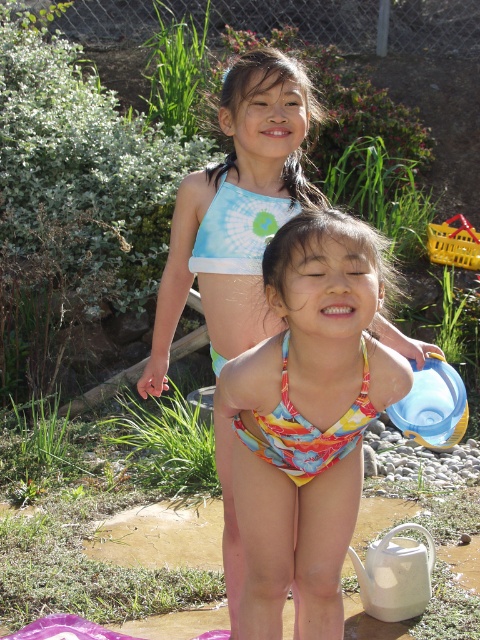
Question: Which point appears closest to the camera in this image?

Choices:
 (A) (232, 529)
 (B) (345, 413)

Answer: (B)

Question: Observing the image, what is the correct spatial positioning of multicolored fabric swimsuit at center in reference to multicolored printed swimsuit at center?

Choices:
 (A) above
 (B) below

Answer: (B)

Question: Considering the real-world distances, which object is farthest from the printed fabric bikini at center?

Choices:
 (A) multicolored printed swimsuit at center
 (B) multicolored fabric swimsuit at center

Answer: (A)

Question: Does multicolored printed swimsuit at center appear over printed fabric bikini at center?

Choices:
 (A) yes
 (B) no

Answer: (A)

Question: Among these objects, which one is nearest to the camera?

Choices:
 (A) printed fabric bikini at center
 (B) multicolored fabric swimsuit at center
 (C) multicolored printed swimsuit at center

Answer: (B)

Question: Is multicolored fabric swimsuit at center wider than printed fabric bikini at center?

Choices:
 (A) yes
 (B) no

Answer: (A)